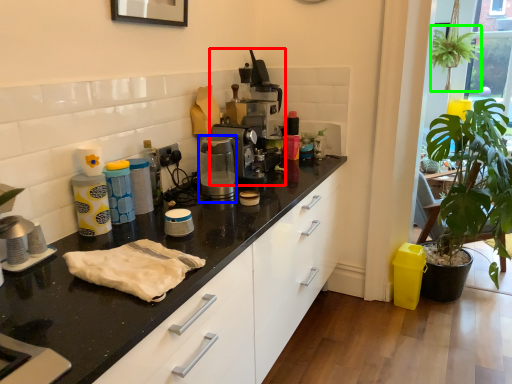
Question: Which object is the closest to the coffee machine (highlighted by a red box)? Choose among these: coffee machine (highlighted by a blue box) or plant (highlighted by a green box).

Choices:
 (A) coffee machine
 (B) plant

Answer: (A)